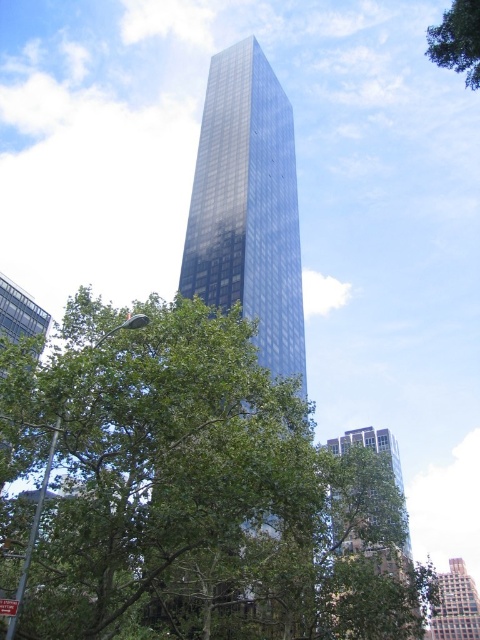
What are the coordinates of the glossy glass tower at center?

The glossy glass tower at center is located at coordinates point (248, 205).

You are a city planner evaluating the urban space. Considering the green leafy tree at center and the blue glass skyscraper at center, which one is shorter?

The green leafy tree at center is not as tall as the blue glass skyscraper at center, so the green leafy tree at center is shorter.